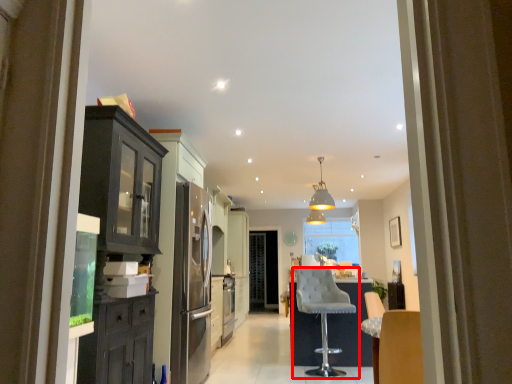
Question: From the image's perspective, where is chair (annotated by the red box) located relative to light fixture?

Choices:
 (A) above
 (B) below

Answer: (B)